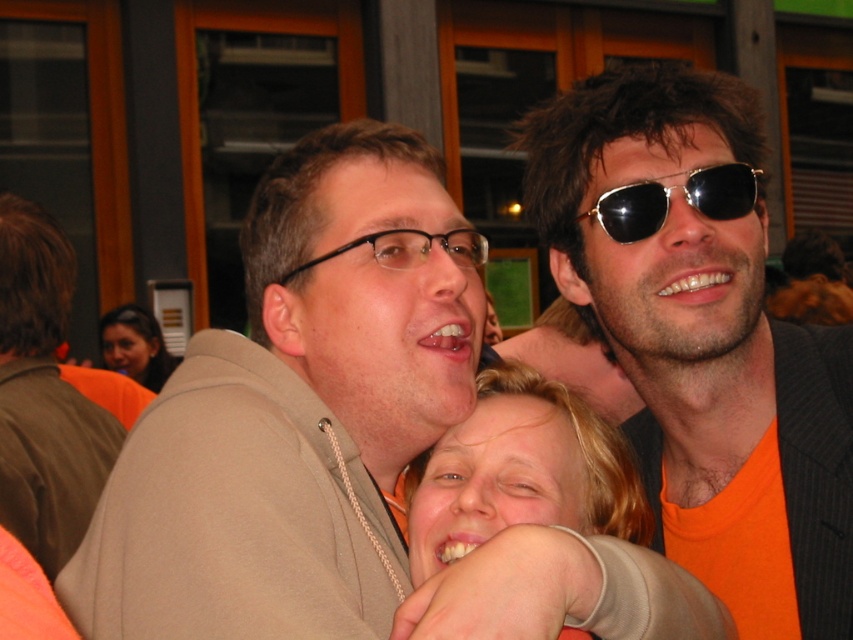
You are a photographer trying to capture a clear shot of both the blonde hair at center and the matte orange shirt at upper left. Since you can only focus on one subject at a time, which one should you choose to ensure the other is still somewhat visible but slightly blurred?

You should focus on the blonde hair at center because it is in front of the matte orange shirt at upper left, so if you focus on it, the matte orange shirt at upper left will be slightly blurred but still visible.

From the picture: You are standing in the social setting shown in the image. There is a point at coordinates (294, 410). What object is located at that point?

The point at coordinates (294, 410) indicates the matte beige hoodie at center.

You are a photographer standing in the scene and want to take a photo of both the matte brown jacket at left and the gold reflective sunglasses at upper right. The minimum distance your camera can focus on two objects simultaneously is 1.5 meters. Will both objects be in focus?

The matte brown jacket at left is 1.69 meters from the gold reflective sunglasses at upper right. Since the distance between them is greater than the camera minimum focus requirement of 1.5 meters, both objects will be in focus.